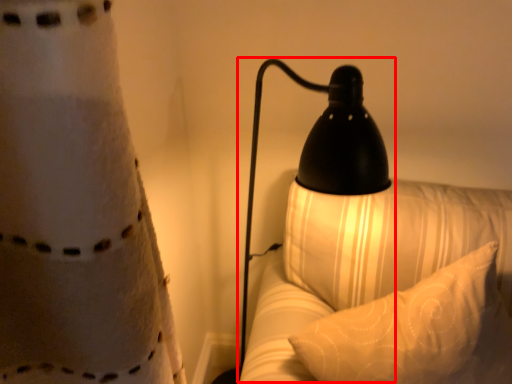
Question: From the image's perspective, where is lamp (annotated by the red box) located in relation to pillow in the image?

Choices:
 (A) below
 (B) above

Answer: (B)